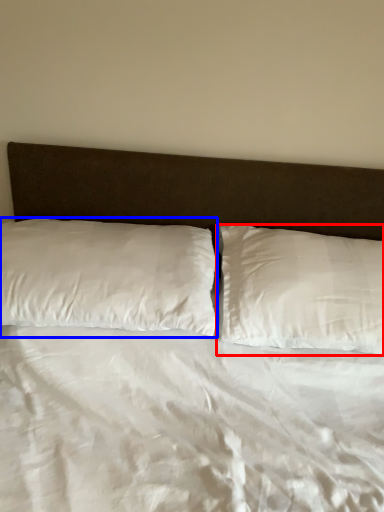
Question: Among these objects, which one is nearest to the camera, pillow (highlighted by a red box) or pillow (highlighted by a blue box)?

Choices:
 (A) pillow
 (B) pillow

Answer: (B)